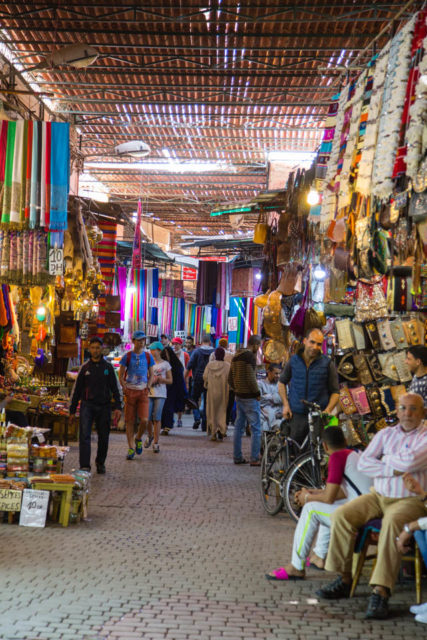
The width and height of the screenshot is (427, 640). Identify the location of 1 area of sheets. (170, 313).